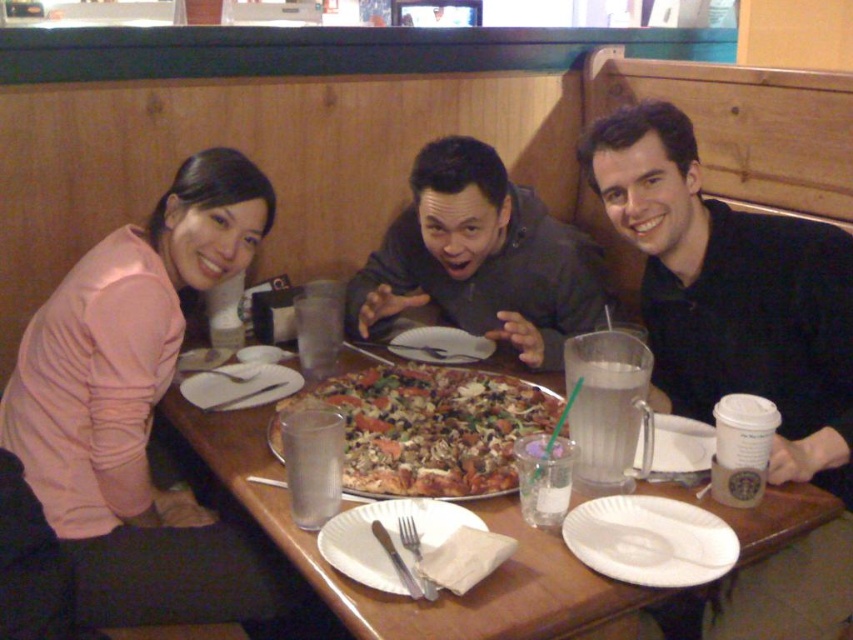
You are a delivery person who just arrived at the restaurant and need to place a small package on the brown wooden table at center. Considering your height is 6 feet tall, can you comfortably reach the table without bending down?

The brown wooden table at center is 36.19 inches away from the viewer. Since the average table height is around 29 inches and the delivery person is 6 feet tall, they would need to bend down slightly to place the package on the table.

You are a customer sitting at the brown wooden table at center. You want to reach for the white paper plate at lower center. Is the plate located above or below the table?

The brown wooden table at center is positioned under the white paper plate at lower center, so the plate is located above the table.

You are a customer at the restaurant and want to place your napkin on the table. Which object should you use to place the napkin, the brown wooden table at center or the white paper plate at lower center?

The brown wooden table at center is larger in size than the white paper plate at lower center, so you should place the napkin on the brown wooden table at center as it provides a bigger surface area.